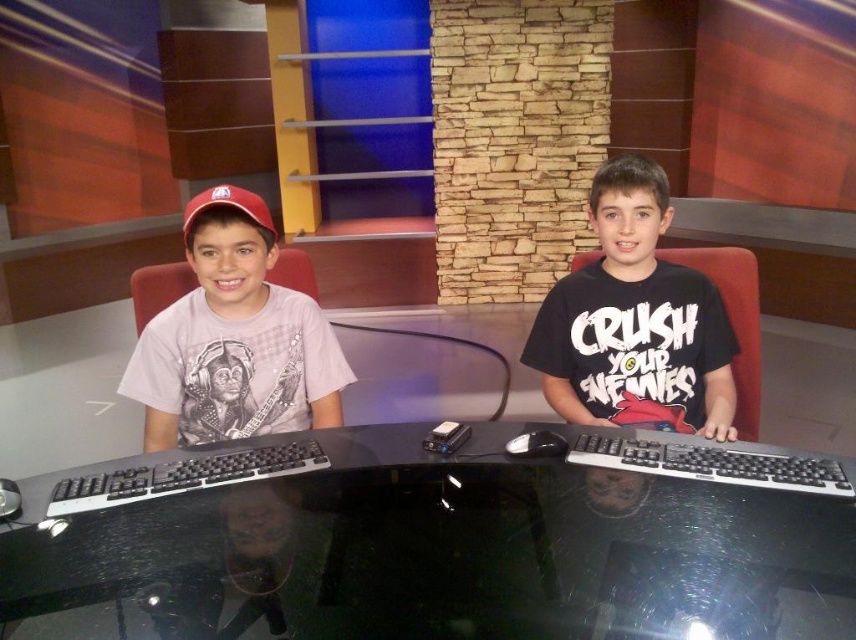
Question: Is black glossy computer desk at center above black plastic keyboard at left?

Choices:
 (A) no
 (B) yes

Answer: (A)

Question: Does black glossy computer desk at center appear on the left side of black plastic keyboard at center?

Choices:
 (A) yes
 (B) no

Answer: (A)

Question: Is black glossy computer desk at center further to the viewer compared to matte red baseball cap at left?

Choices:
 (A) no
 (B) yes

Answer: (A)

Question: Estimate the real-world distances between objects in this image. Which object is farther from the black plastic mouse at center?

Choices:
 (A) black plastic keyboard at left
 (B) black plastic keyboard at center
 (C) matte gray t-shirt at left

Answer: (C)

Question: Among these objects, which one is nearest to the camera?

Choices:
 (A) black matte t-shirt at center
 (B) matte red baseball cap at left
 (C) black plastic keyboard at center

Answer: (C)

Question: Considering the real-world distances, which object is closest to the matte gray t-shirt at left?

Choices:
 (A) black plastic keyboard at left
 (B) black plastic keyboard at center

Answer: (A)